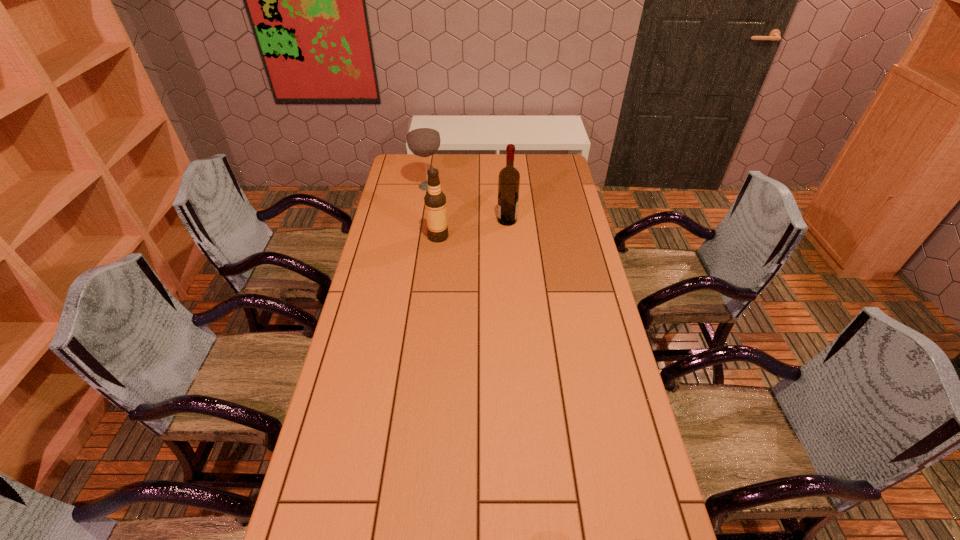
Where is `the second nearest object`? Image resolution: width=960 pixels, height=540 pixels. the second nearest object is located at coordinates (509, 177).

Where is `the rightmost alcohol`? This screenshot has height=540, width=960. the rightmost alcohol is located at coordinates (509, 177).

I want to click on the farthest object, so click(x=423, y=139).

Locate an element on the screen. the nearest alcohol is located at coordinates (435, 200).

Locate an element on the screen. Image resolution: width=960 pixels, height=540 pixels. vacant space located 0.140m on the front and back of the second farthest alcohol is located at coordinates (465, 220).

Where is `free space located on the front and back of the second farthest alcohol`? The width and height of the screenshot is (960, 540). free space located on the front and back of the second farthest alcohol is located at coordinates (444, 220).

Locate an element on the screen. Image resolution: width=960 pixels, height=540 pixels. free space located 0.310m on the front and back of the second farthest alcohol is located at coordinates (424, 220).

Find the location of `free location located on the front of the farthest alcohol`. free location located on the front of the farthest alcohol is located at coordinates (419, 249).

Image resolution: width=960 pixels, height=540 pixels. What are the coordinates of `free space located on the label of the nearest alcohol` in the screenshot? It's located at (466, 237).

I want to click on object that is at the far edge, so click(x=423, y=139).